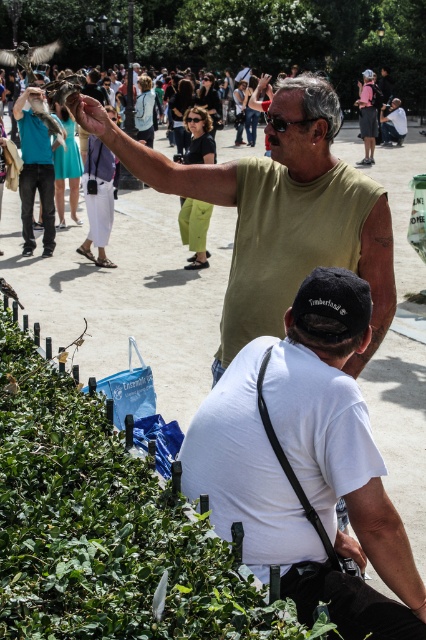
Does point (109, 444) come farther from viewer compared to point (22, 152)?

No, (109, 444) is closer to viewer.

Which is behind, point (91, 568) or point (28, 88)?

Positioned behind is point (28, 88).

Measure the distance between point (77,424) and camera.

Point (77,424) is 9.64 feet from camera.

This screenshot has height=640, width=426. I want to click on green leafy hedge at lower left, so click(104, 529).

Does green leafy hedge at lower left lie in front of green matte tank top at upper center?

Yes, it is.

Describe the element at coordinates (104, 529) in the screenshot. I see `green leafy hedge at lower left` at that location.

Which is in front, point (218, 577) or point (267, 236)?

Point (218, 577)

The image size is (426, 640). Find the location of `green leafy hedge at lower left`. green leafy hedge at lower left is located at coordinates (104, 529).

Can you confirm if green leafy hedge at lower left is thinner than white matte shirt at lower center?

No, green leafy hedge at lower left is not thinner than white matte shirt at lower center.

What do you see at coordinates (104, 529) in the screenshot?
I see `green leafy hedge at lower left` at bounding box center [104, 529].

At what (x,y) coordinates should I click in order to perform the action: click on green leafy hedge at lower left. Please return your answer as a coordinate pair (x, y). The width and height of the screenshot is (426, 640). Looking at the image, I should click on 104,529.